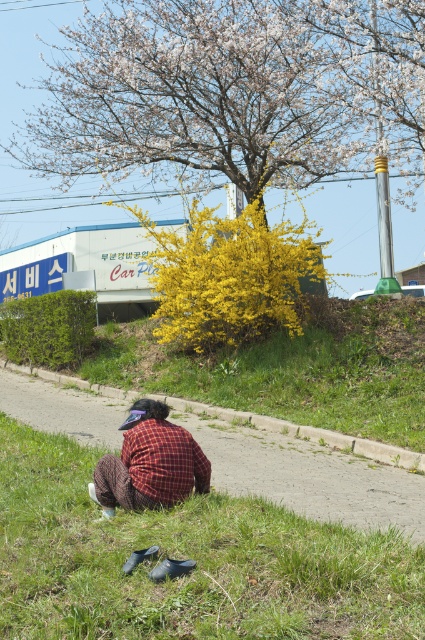
Is point (104, 593) more distant than point (136, 449)?

No, (104, 593) is closer to viewer.

Is point (203, 496) farther from viewer compared to point (193, 458)?

Yes, it is behind point (193, 458).

This screenshot has width=425, height=640. In order to click on green grass at lower center in this screenshot , I will do 187,557.

Which is in front, point (278, 152) or point (232, 436)?

Point (232, 436) is in front.

Locate an element on the screen. This screenshot has height=640, width=425. fluffy white blossoms at upper center is located at coordinates (231, 90).

Can you confirm if fluffy white blossoms at upper center is positioned to the right of plaid fabric shirt at lower center?

Indeed, fluffy white blossoms at upper center is positioned on the right side of plaid fabric shirt at lower center.

Is fluffy white blossoms at upper center smaller than plaid fabric shirt at lower center?

No.

Is point (419, 132) positioned after point (201, 465)?

That is True.

The height and width of the screenshot is (640, 425). Find the location of `fluffy white blossoms at upper center`. fluffy white blossoms at upper center is located at coordinates (231, 90).